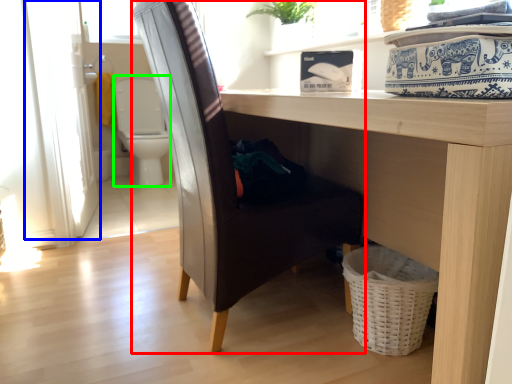
Question: Estimate the real-world distances between objects in this image. Which object is farther from chair (highlighted by a red box), screen door (highlighted by a blue box) or swivel chair (highlighted by a green box)?

Choices:
 (A) screen door
 (B) swivel chair

Answer: (B)